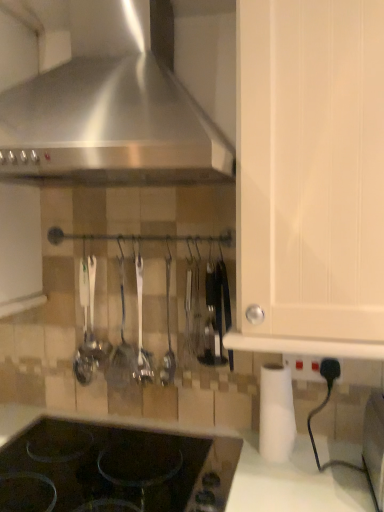
Identify the location of white matte paper towel at lower right. The width and height of the screenshot is (384, 512). (276, 414).

This screenshot has width=384, height=512. What do you see at coordinates (276, 414) in the screenshot? I see `white matte paper towel at lower right` at bounding box center [276, 414].

The height and width of the screenshot is (512, 384). What do you see at coordinates (211, 312) in the screenshot?
I see `black plastic knife at center` at bounding box center [211, 312].

The image size is (384, 512). I want to click on black glass gas stove at lower left, so click(x=114, y=469).

The height and width of the screenshot is (512, 384). Describe the element at coordinates (102, 98) in the screenshot. I see `stainless steel range hood at upper left` at that location.

Image resolution: width=384 pixels, height=512 pixels. Find the location of `white matte cabinet door at center-right`. white matte cabinet door at center-right is located at coordinates tap(310, 177).

The width and height of the screenshot is (384, 512). Identify the location of white matte paper towel at lower right. (276, 414).

Is polished metal spoon at center, which ranks as the 1th silverware in left-to-right order, positioned before silver polished spoon at center, which ranks as the 2th silverware in left-to-right order?

No, it is behind silver polished spoon at center, which ranks as the 2th silverware in left-to-right order.

Does point (119, 376) appear closer or farther from the camera than point (148, 356)?

Point (119, 376) is farther from the camera than point (148, 356).

Consider the image. Is polished metal spoon at center, which is the second silverware in right-to-left order, far from silver polished spoon at center, the 1th silverware from the right?

No, polished metal spoon at center, which is the second silverware in right-to-left order, is in close proximity to silver polished spoon at center, the 1th silverware from the right.

Is silver polished spoon at center, the 1th silverware from the right, located within polished metal spoon at center, which ranks as the 1th silverware in left-to-right order?

No, silver polished spoon at center, the 1th silverware from the right, is not inside polished metal spoon at center, which ranks as the 1th silverware in left-to-right order.

Visually, is white plastic electric outlet at lower right positioned to the left or to the right of black glass gas stove at lower left?

Clearly, white plastic electric outlet at lower right is on the right of black glass gas stove at lower left in the image.

Is white plastic electric outlet at lower right facing away from black glass gas stove at lower left?

No, white plastic electric outlet at lower right is not facing the opposite direction of black glass gas stove at lower left.

Based on the photo, between white plastic electric outlet at lower right and black glass gas stove at lower left, which one has larger size?

Bigger between the two is black glass gas stove at lower left.

Measure the distance from white plastic electric outlet at lower right to black glass gas stove at lower left.

white plastic electric outlet at lower right is 47.15 centimeters from black glass gas stove at lower left.

Consider the image. Is black glass gas stove at lower left not near polished metal spoon at center, which is the second silverware in right-to-left order?

No, black glass gas stove at lower left is in close proximity to polished metal spoon at center, which is the second silverware in right-to-left order.

Is black glass gas stove at lower left bigger than polished metal spoon at center, which ranks as the 1th silverware in left-to-right order?

Indeed, black glass gas stove at lower left has a larger size compared to polished metal spoon at center, which ranks as the 1th silverware in left-to-right order.

Would you say polished metal spoon at center, which ranks as the 1th silverware in left-to-right order, is part of black glass gas stove at lower left's contents?

Definitely not — polished metal spoon at center, which ranks as the 1th silverware in left-to-right order, is not inside black glass gas stove at lower left.

Could you tell me if white matte cabinet door at center-right is facing polished metal spoon at center, which ranks as the 1th silverware in left-to-right order?

No, white matte cabinet door at center-right is not oriented towards polished metal spoon at center, which ranks as the 1th silverware in left-to-right order.

From a real-world perspective, is white matte cabinet door at center-right located higher than polished metal spoon at center, which ranks as the 1th silverware in left-to-right order?

Correct, in the physical world, white matte cabinet door at center-right is higher than polished metal spoon at center, which ranks as the 1th silverware in left-to-right order.

Between white plastic electric outlet at lower right and silver polished spoon at center, which ranks as the 2th silverware in left-to-right order, which one has larger width?

Wider between the two is silver polished spoon at center, which ranks as the 2th silverware in left-to-right order.

Can you confirm if white plastic electric outlet at lower right is bigger than silver polished spoon at center, which ranks as the 2th silverware in left-to-right order?

Incorrect, white plastic electric outlet at lower right is not larger than silver polished spoon at center, which ranks as the 2th silverware in left-to-right order.

Is white plastic electric outlet at lower right with silver polished spoon at center, the 1th silverware from the right?

No, white plastic electric outlet at lower right is not beside silver polished spoon at center, the 1th silverware from the right.

From a real-world perspective, is white plastic electric outlet at lower right positioned above or below silver polished spoon at center, which ranks as the 2th silverware in left-to-right order?

From a real-world perspective, white plastic electric outlet at lower right is physically below silver polished spoon at center, which ranks as the 2th silverware in left-to-right order.

Looking at the image, does white plastic electric outlet at lower right seem bigger or smaller compared to black plastic knife at center?

In the image, white plastic electric outlet at lower right appears to be smaller than black plastic knife at center.

Does white plastic electric outlet at lower right come behind black plastic knife at center?

Yes, white plastic electric outlet at lower right is behind black plastic knife at center.

Can you confirm if white plastic electric outlet at lower right is thinner than black plastic knife at center?

Yes.

The image size is (384, 512). Find the location of `cutlery above the white plastic electric outlet at lower right (from a real-world perspective)`. cutlery above the white plastic electric outlet at lower right (from a real-world perspective) is located at coordinates (211, 312).

Locate an element on the screen. This screenshot has height=512, width=384. paper towel lying below the silver polished spoon at center, which ranks as the 2th silverware in left-to-right order (from the image's perspective) is located at coordinates (276, 414).

Is there a large distance between silver polished spoon at center, the 1th silverware from the right, and white matte paper towel at lower right?

No, silver polished spoon at center, the 1th silverware from the right, is not far away from white matte paper towel at lower right.

Which is nearer, (139, 278) or (272, 368)?

The point (272, 368) is in front.

From a real-world perspective, is silver polished spoon at center, the 1th silverware from the right, under white matte paper towel at lower right?

No, from a real-world perspective, silver polished spoon at center, the 1th silverware from the right, is not beneath white matte paper towel at lower right.

You are a GUI agent. You are given a task and a screenshot of the screen. Output one action in this format:
    pyautogui.click(x=<x>, y=<y>)
    Task: Click on the silverware above the silver polished spoon at center, which ranks as the 2th silverware in left-to-right order (from the image's perspective)
    
    Given the screenshot: What is the action you would take?
    pyautogui.click(x=121, y=345)

You are a GUI agent. You are given a task and a screenshot of the screen. Output one action in this format:
    pyautogui.click(x=<x>, y=<y>)
    Task: Click on the gas stove in front of the white plastic electric outlet at lower right
    The image size is (384, 512).
    Given the screenshot: What is the action you would take?
    pyautogui.click(x=114, y=469)

Looking at the image, which one is located closer to silver polished spoon at center, which ranks as the 2th silverware in left-to-right order, white matte paper towel at lower right or black glass gas stove at lower left?

black glass gas stove at lower left is positioned closer to the anchor silver polished spoon at center, which ranks as the 2th silverware in left-to-right order.

When comparing their distances from black plastic knife at center, does white plastic electric outlet at lower right or white matte cabinet door at center-right seem further?

white matte cabinet door at center-right is positioned further to the anchor black plastic knife at center.

Estimate the real-world distances between objects in this image. Which object is closer to black glass gas stove at lower left, stainless steel range hood at upper left or white plastic electric outlet at lower right?

white plastic electric outlet at lower right.

From the picture: Based on their spatial positions, is polished metal spoon at center, which ranks as the 1th silverware in left-to-right order, or silver polished spoon at center, which ranks as the 2th silverware in left-to-right order, closer to white matte cabinet door at center-right?

silver polished spoon at center, which ranks as the 2th silverware in left-to-right order, is positioned closer to the anchor white matte cabinet door at center-right.

Which object lies further to the anchor point white matte paper towel at lower right, black plastic knife at center or silver polished spoon at center, which ranks as the 2th silverware in left-to-right order?

Among the two, silver polished spoon at center, which ranks as the 2th silverware in left-to-right order, is located further to white matte paper towel at lower right.

When comparing their distances from black glass gas stove at lower left, does silver polished spoon at center, the 1th silverware from the right, or stainless steel range hood at upper left seem further?

stainless steel range hood at upper left lies further to black glass gas stove at lower left than the other object.

From the image, which object appears to be farther from stainless steel range hood at upper left, polished metal spoon at center, which is the second silverware in right-to-left order, or white matte paper towel at lower right?

white matte paper towel at lower right.

Considering their positions, is silver polished spoon at center, the 1th silverware from the right, positioned further to stainless steel range hood at upper left than white matte cabinet door at center-right?

silver polished spoon at center, the 1th silverware from the right, is positioned further to the anchor stainless steel range hood at upper left.

Find the location of `cabinetry between stainless steel range hood at upper left and white matte paper towel at lower right in the vertical direction`. cabinetry between stainless steel range hood at upper left and white matte paper towel at lower right in the vertical direction is located at coordinates (310, 177).

Locate an element on the screen. The width and height of the screenshot is (384, 512). cutlery between stainless steel range hood at upper left and polished metal spoon at center, which is the second silverware in right-to-left order, in the up-down direction is located at coordinates (211, 312).

Identify the location of silverware between polished metal spoon at center, which ranks as the 1th silverware in left-to-right order, and white plastic electric outlet at lower right. (141, 330).

Identify the location of cutlery between stainless steel range hood at upper left and white plastic electric outlet at lower right in the vertical direction. This screenshot has height=512, width=384. (211, 312).